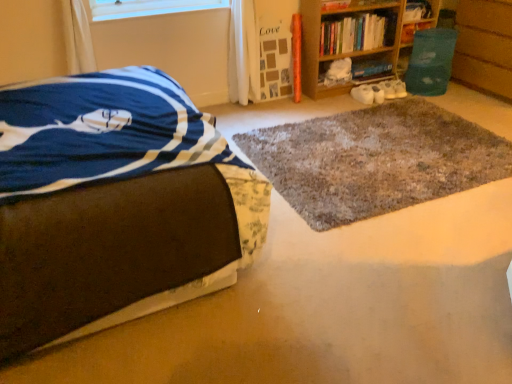
Image resolution: width=512 pixels, height=384 pixels. What do you see at coordinates (370, 68) in the screenshot?
I see `hardcover book at center, placed as the second book when sorted from left to right` at bounding box center [370, 68].

What do you see at coordinates (148, 7) in the screenshot?
I see `transparent plastic window screen at upper center` at bounding box center [148, 7].

This screenshot has height=384, width=512. I want to click on transparent plastic window screen at upper center, so click(x=148, y=7).

This screenshot has width=512, height=384. What do you see at coordinates (357, 33) in the screenshot?
I see `wooden bookshelf at upper right, which appears as the first book when viewed from the left` at bounding box center [357, 33].

What is the approximate height of green plastic bin at right?

It is 30.84 inches.

Based on the photo, measure the distance between point (463, 187) and camera.

Point (463, 187) and camera are 2.47 meters apart.

I want to click on brown fabric bed at left, so click(x=114, y=204).

Is wooden bookshelf at upper right thinner than hardcover book at upper right, which appears as the 1th book when viewed from the right?

Incorrect, the width of wooden bookshelf at upper right is not less than that of hardcover book at upper right, which appears as the 1th book when viewed from the right.

Is wooden bookshelf at upper right oriented towards hardcover book at upper right, which appears as the 1th book when viewed from the right?

No, wooden bookshelf at upper right is not aimed at hardcover book at upper right, which appears as the 1th book when viewed from the right.

Can hardcover book at upper right, which appears as the 1th book when viewed from the right, be found inside wooden bookshelf at upper right?

Actually, hardcover book at upper right, which appears as the 1th book when viewed from the right, is outside wooden bookshelf at upper right.

Is point (353, 26) farther from viewer compared to point (411, 16)?

No, it is not.

Considering the positions of point (366, 68) and point (315, 45), is point (366, 68) closer or farther from the camera than point (315, 45)?

Point (366, 68) appears to be farther away from the viewer than point (315, 45).

Is hardcover book at center, placed as the second book when sorted from left to right, at the left side of wooden bookshelf at upper right?

No, hardcover book at center, placed as the second book when sorted from left to right, is not to the left of wooden bookshelf at upper right.

Based on the photo, from the image's perspective, is hardcover book at center, placed as the second book when sorted from left to right, located above or below wooden bookshelf at upper right?

hardcover book at center, placed as the second book when sorted from left to right, is below wooden bookshelf at upper right.

Which object is thinner, hardcover book at center, placed as the second book when sorted from left to right, or wooden bookshelf at upper right?

Thinner between the two is hardcover book at center, placed as the second book when sorted from left to right.

Based on their sizes in the image, would you say brown fabric bed at left is bigger or smaller than shaggy gray rug at center?

In the image, brown fabric bed at left appears to be larger than shaggy gray rug at center.

From a real-world perspective, who is located higher, brown fabric bed at left or shaggy gray rug at center?

brown fabric bed at left, from a real-world perspective.

Does brown fabric bed at left contain shaggy gray rug at center?

No, shaggy gray rug at center is not surrounded by brown fabric bed at left.

Would you consider brown fabric bed at left to be distant from shaggy gray rug at center?

brown fabric bed at left is far away from shaggy gray rug at center.

Is wooden bookshelf at upper right, which appears as the first book when viewed from the left, positioned with its back to hardcover book at upper right, the second book in the right-to-left sequence?

No, wooden bookshelf at upper right, which appears as the first book when viewed from the left,'s orientation is not away from hardcover book at upper right, the second book in the right-to-left sequence.

Which is more to the right, wooden bookshelf at upper right, the 4th book positioned from the right, or hardcover book at upper right, the second book in the right-to-left sequence?

hardcover book at upper right, the second book in the right-to-left sequence, is more to the right.

Does wooden bookshelf at upper right, the 4th book positioned from the right, touch hardcover book at upper right, positioned as the third book in left-to-right order?

wooden bookshelf at upper right, the 4th book positioned from the right, is not next to hardcover book at upper right, positioned as the third book in left-to-right order, and they're not touching.

Does point (352, 51) come closer to viewer compared to point (422, 29)?

No.

From a real-world perspective, is green plastic bin at right below hardcover book at upper right, which is the 4th book in left-to-right order?

Correct, in the physical world, green plastic bin at right is lower than hardcover book at upper right, which is the 4th book in left-to-right order.

In terms of size, does green plastic bin at right appear bigger or smaller than hardcover book at upper right, which is the 4th book in left-to-right order?

Clearly, green plastic bin at right is larger in size than hardcover book at upper right, which is the 4th book in left-to-right order.

Which of these two, green plastic bin at right or hardcover book at upper right, which is the 4th book in left-to-right order, is wider?

With larger width is green plastic bin at right.

Is green plastic bin at right outside of hardcover book at upper right, which is the 4th book in left-to-right order?

green plastic bin at right lies outside hardcover book at upper right, which is the 4th book in left-to-right order,'s area.

Considering the positions of objects hardcover book at upper right, positioned as the third book in left-to-right order, and brown fabric bed at left in the image provided, who is in front, hardcover book at upper right, positioned as the third book in left-to-right order, or brown fabric bed at left?

brown fabric bed at left is more forward.

I want to click on bed in front of the hardcover book at upper right, the second book in the right-to-left sequence, so tap(114, 204).

How far apart are hardcover book at upper right, positioned as the third book in left-to-right order, and brown fabric bed at left?

2.90 meters.

Could you tell me if hardcover book at upper right, the second book in the right-to-left sequence, is turned towards brown fabric bed at left?

No, hardcover book at upper right, the second book in the right-to-left sequence, is not facing towards brown fabric bed at left.

From the image's perspective, does hardcover book at upper right, the second book in the right-to-left sequence, appear lower than hardcover book at upper right, which is the 4th book in left-to-right order?

Yes.

Based on the photo, can you tell me how much hardcover book at upper right, positioned as the third book in left-to-right order, and hardcover book at upper right, which appears as the 1th book when viewed from the right, differ in facing direction?

The facing directions of hardcover book at upper right, positioned as the third book in left-to-right order, and hardcover book at upper right, which appears as the 1th book when viewed from the right, are 0.000188 degrees apart.

Is hardcover book at upper right, positioned as the third book in left-to-right order, far away from hardcover book at upper right, which appears as the 1th book when viewed from the right?

No.

Between hardcover book at upper right, the second book in the right-to-left sequence, and hardcover book at upper right, which is the 4th book in left-to-right order, which one has more height?

hardcover book at upper right, which is the 4th book in left-to-right order.

Which book is the 4th one when counting from the right side of the wooden bookshelf at upper right? Please provide its 2D coordinates.

[(417, 10)]

Find the location of a particular element. This screenshot has width=512, height=384. the 3rd book behind when counting from the wooden bookshelf at upper right is located at coordinates (370, 68).

From the image, which object appears to be farther from transparent plastic window screen at upper center, shaggy gray rug at center or wooden bookshelf at upper right, the 4th book positioned from the right?

shaggy gray rug at center lies further to transparent plastic window screen at upper center than the other object.

From the image, which object appears to be farther from brown fabric bed at left, green plastic bin at right or hardcover book at center, placed as the second book when sorted from left to right?

The object further to brown fabric bed at left is green plastic bin at right.

Looking at the image, which one is located further to green plastic bin at right, hardcover book at upper right, positioned as the third book in left-to-right order, or brown fabric bed at left?

brown fabric bed at left.

Estimate the real-world distances between objects in this image. Which object is closer to hardcover book at center, the third book viewed from the right, transparent plastic window screen at upper center or hardcover book at upper right, which is the 4th book in left-to-right order?

Based on the image, hardcover book at upper right, which is the 4th book in left-to-right order, appears to be nearer to hardcover book at center, the third book viewed from the right.

Looking at the image, which one is located further to hardcover book at upper right, which appears as the 1th book when viewed from the right, wooden bookshelf at upper right or hardcover book at upper right, positioned as the third book in left-to-right order?

The object further to hardcover book at upper right, which appears as the 1th book when viewed from the right, is wooden bookshelf at upper right.

Based on their spatial positions, is transparent plastic window screen at upper center or hardcover book at upper right, positioned as the third book in left-to-right order, further from hardcover book at center, the third book viewed from the right?

transparent plastic window screen at upper center is positioned further to the anchor hardcover book at center, the third book viewed from the right.

Which object lies nearer to the anchor point transparent plastic window screen at upper center, hardcover book at center, placed as the second book when sorted from left to right, or wooden bookshelf at upper right?

Based on the image, wooden bookshelf at upper right appears to be nearer to transparent plastic window screen at upper center.

Estimate the real-world distances between objects in this image. Which object is further from transparent plastic window screen at upper center, wooden bookshelf at upper right, the 4th book positioned from the right, or shaggy gray rug at center?

The object further to transparent plastic window screen at upper center is shaggy gray rug at center.

Where is `mat between brown fabric bed at left and hardcover book at upper right, positioned as the third book in left-to-right order, from front to back`? The image size is (512, 384). mat between brown fabric bed at left and hardcover book at upper right, positioned as the third book in left-to-right order, from front to back is located at coordinates (375, 160).

Locate an element on the screen. The width and height of the screenshot is (512, 384). book between hardcover book at upper right, the second book in the right-to-left sequence, and green plastic bin at right, in the horizontal direction is located at coordinates (417, 10).

The width and height of the screenshot is (512, 384). I want to click on bookcase located between transparent plastic window screen at upper center and wooden bookshelf at upper right, the 4th book positioned from the right, in the left-right direction, so click(x=354, y=38).

Locate an element on the screen. The image size is (512, 384). bookcase between transparent plastic window screen at upper center and shaggy gray rug at center in the horizontal direction is located at coordinates (354, 38).